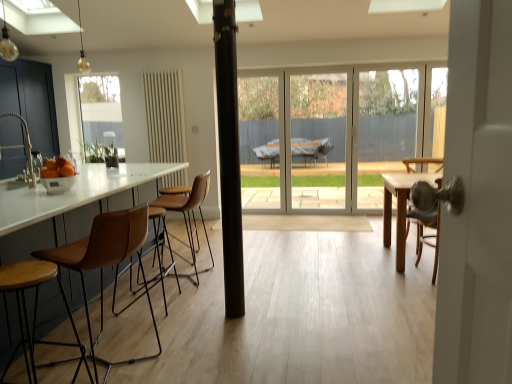
Find the location of a particular element. This screenshot has width=512, height=384. free space below brown leather stool at left (from a real-world perspective) is located at coordinates (118, 354).